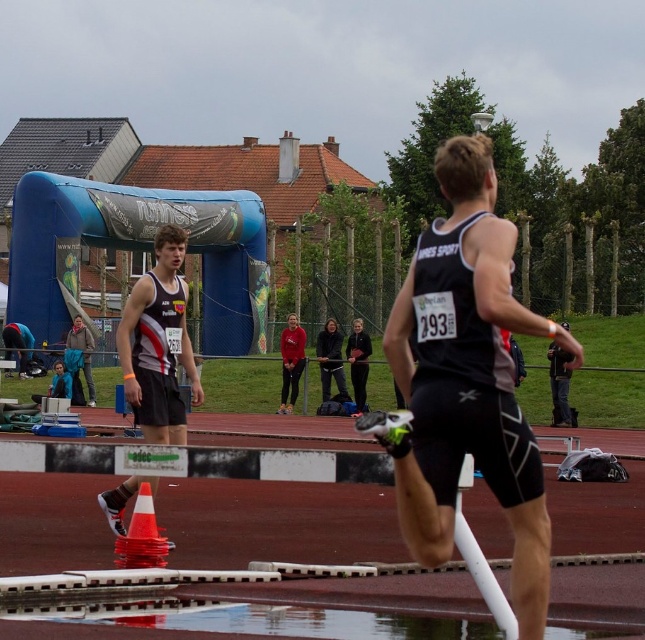
In the scene shown: Who is taller, dark gray fabric jacket at right or matte black tank top at center?

dark gray fabric jacket at right is taller.

Does dark gray fabric jacket at right have a smaller size compared to matte black tank top at center?

Yes, dark gray fabric jacket at right is smaller than matte black tank top at center.

I want to click on dark gray fabric jacket at right, so click(x=561, y=385).

Can you confirm if black matte singlet at center is smaller than matte red hoodie at center?

Incorrect, black matte singlet at center is not smaller in size than matte red hoodie at center.

Does point (457, 262) come farther from viewer compared to point (299, 372)?

That is False.

Which is behind, point (493, 493) or point (290, 376)?

The point (290, 376) is more distant.

Identify the location of black matte singlet at center. The width and height of the screenshot is (645, 640). (466, 380).

Does matte black singlet at center lie behind dark gray fabric jacket at right?

No, matte black singlet at center is in front of dark gray fabric jacket at right.

You are a GUI agent. You are given a task and a screenshot of the screen. Output one action in this format:
    pyautogui.click(x=<x>, y=<y>)
    Task: Click on the matte black singlet at center
    The width and height of the screenshot is (645, 640).
    Given the screenshot: What is the action you would take?
    pyautogui.click(x=157, y=342)

Find the location of `matte black singlet at center`. matte black singlet at center is located at coordinates (157, 342).